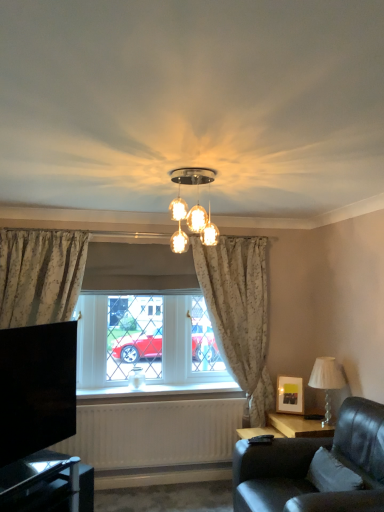
Question: Is black glossy tv at lower left located within translucent glass chandelier at center, acting as the second lamp starting from the right?

Choices:
 (A) no
 (B) yes

Answer: (A)

Question: From a real-world perspective, is translucent glass chandelier at center, the 1th lamp from the front, under black glossy tv at lower left?

Choices:
 (A) yes
 (B) no

Answer: (B)

Question: From the image's perspective, is translucent glass chandelier at center, the 1th lamp from the front, above black glossy tv at lower left?

Choices:
 (A) no
 (B) yes

Answer: (B)

Question: Is translucent glass chandelier at center, the 2th lamp ordered from the bottom, not within black glossy tv at lower left?

Choices:
 (A) yes
 (B) no

Answer: (A)

Question: Can you see translucent glass chandelier at center, acting as the second lamp starting from the right, touching black glossy tv at lower left?

Choices:
 (A) no
 (B) yes

Answer: (A)

Question: Considering the positions of point (259, 241) and point (342, 496), is point (259, 241) closer or farther from the camera than point (342, 496)?

Choices:
 (A) closer
 (B) farther

Answer: (B)

Question: From the image's perspective, is white floral fabric curtain at center positioned above or below leather couch at lower right?

Choices:
 (A) above
 (B) below

Answer: (A)

Question: Based on their positions, is white floral fabric curtain at center located to the left or right of leather couch at lower right?

Choices:
 (A) right
 (B) left

Answer: (B)

Question: Considering the positions of white floral fabric curtain at center and leather couch at lower right in the image, is white floral fabric curtain at center wider or thinner than leather couch at lower right?

Choices:
 (A) wide
 (B) thin

Answer: (B)

Question: From their relative heights in the image, would you say white fabric pillow at lower right is taller or shorter than white textured lampshade at right, the second lamp when ordered from top to bottom?

Choices:
 (A) short
 (B) tall

Answer: (A)

Question: Visually, is white fabric pillow at lower right positioned to the left or to the right of white textured lampshade at right, arranged as the first lamp when ordered from the bottom?

Choices:
 (A) left
 (B) right

Answer: (A)

Question: From a real-world perspective, relative to white textured lampshade at right, which is the first lamp in back-to-front order, is white fabric pillow at lower right vertically above or below?

Choices:
 (A) below
 (B) above

Answer: (A)

Question: Based on their sizes in the image, would you say white fabric pillow at lower right is bigger or smaller than white textured lampshade at right, which is the first lamp in back-to-front order?

Choices:
 (A) small
 (B) big

Answer: (A)

Question: Considering the positions of white fabric pillow at lower right and black glass table at lower left in the image, is white fabric pillow at lower right taller or shorter than black glass table at lower left?

Choices:
 (A) tall
 (B) short

Answer: (B)

Question: Would you say white fabric pillow at lower right is to the left or to the right of black glass table at lower left in the picture?

Choices:
 (A) left
 (B) right

Answer: (B)